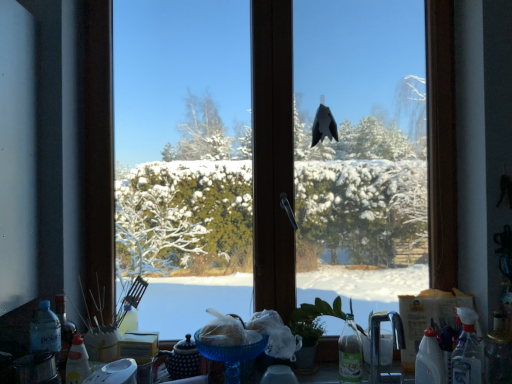
Question: Considering the relative sizes of transparent plastic spray bottle at lower right, the second bottle positioned from the right, and translucent plastic bottle at lower right, the fifth bottle when ordered from left to right, in the image provided, is transparent plastic spray bottle at lower right, the second bottle positioned from the right, taller than translucent plastic bottle at lower right, the fifth bottle when ordered from left to right,?

Choices:
 (A) yes
 (B) no

Answer: (A)

Question: Is translucent plastic bottle at lower right, the fifth bottle when ordered from left to right, inside transparent plastic spray bottle at lower right, which is the fourth bottle from left to right?

Choices:
 (A) yes
 (B) no

Answer: (B)

Question: Considering the relative sizes of transparent plastic spray bottle at lower right, the second bottle positioned from the right, and translucent plastic bottle at lower right, placed as the 1th bottle when sorted from right to left, in the image provided, is transparent plastic spray bottle at lower right, the second bottle positioned from the right, shorter than translucent plastic bottle at lower right, placed as the 1th bottle when sorted from right to left,?

Choices:
 (A) no
 (B) yes

Answer: (A)

Question: Considering the relative sizes of transparent plastic spray bottle at lower right, the second bottle positioned from the right, and translucent plastic bottle at lower right, the fifth bottle when ordered from left to right, in the image provided, is transparent plastic spray bottle at lower right, the second bottle positioned from the right, wider than translucent plastic bottle at lower right, the fifth bottle when ordered from left to right,?

Choices:
 (A) no
 (B) yes

Answer: (A)

Question: Would you say transparent plastic spray bottle at lower right, the second bottle positioned from the right, is outside translucent plastic bottle at lower right, placed as the 1th bottle when sorted from right to left?

Choices:
 (A) yes
 (B) no

Answer: (A)

Question: Is there a large distance between transparent plastic spray bottle at lower right, which is the fourth bottle from left to right, and translucent plastic bottle at lower right, the fifth bottle when ordered from left to right?

Choices:
 (A) no
 (B) yes

Answer: (A)

Question: Is there a large distance between translucent plastic bottle at lower right, the fifth bottle when ordered from left to right, and transparent glass window at center?

Choices:
 (A) no
 (B) yes

Answer: (A)

Question: Considering the relative sizes of translucent plastic bottle at lower right, the fifth bottle when ordered from left to right, and transparent glass window at center in the image provided, is translucent plastic bottle at lower right, the fifth bottle when ordered from left to right, thinner than transparent glass window at center?

Choices:
 (A) yes
 (B) no

Answer: (A)

Question: Is translucent plastic bottle at lower right, placed as the 1th bottle when sorted from right to left, positioned before transparent glass window at center?

Choices:
 (A) yes
 (B) no

Answer: (A)

Question: From a real-world perspective, is translucent plastic bottle at lower right, the fifth bottle when ordered from left to right, physically below transparent glass window at center?

Choices:
 (A) yes
 (B) no

Answer: (A)

Question: Considering the relative sizes of translucent plastic bottle at lower right, the fifth bottle when ordered from left to right, and transparent glass window at center in the image provided, is translucent plastic bottle at lower right, the fifth bottle when ordered from left to right, shorter than transparent glass window at center?

Choices:
 (A) no
 (B) yes

Answer: (B)

Question: From the image's perspective, would you say translucent plastic bottle at lower right, the fifth bottle when ordered from left to right, is shown under transparent glass window at center?

Choices:
 (A) yes
 (B) no

Answer: (A)

Question: Can you confirm if transparent plastic spray bottle at lower right, the second bottle positioned from the right, is bigger than translucent plastic bottle at lower left, which is counted as the second bottle, starting from the left?

Choices:
 (A) no
 (B) yes

Answer: (B)